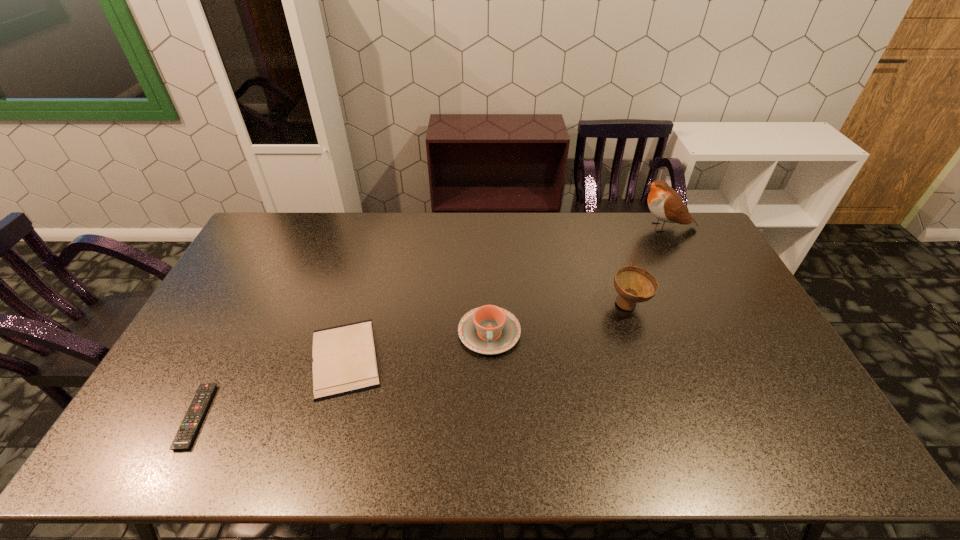
The height and width of the screenshot is (540, 960). Identify the location of the rightmost object. (664, 202).

Locate an element on the screen. The image size is (960, 540). the farthest object is located at coordinates (664, 202).

Locate an element on the screen. This screenshot has width=960, height=540. the fourth object from left to right is located at coordinates (634, 285).

Where is `the fourth shortest object`? the fourth shortest object is located at coordinates (634, 285).

Locate an element on the screen. This screenshot has width=960, height=540. the third tallest object is located at coordinates (489, 329).

Identify the location of chinaware. This screenshot has height=540, width=960. (489, 329).

Image resolution: width=960 pixels, height=540 pixels. Identify the location of the second shortest object. (344, 357).

Identify the location of the fourth object from right to left. The height and width of the screenshot is (540, 960). (344, 357).

Locate an element on the screen. The image size is (960, 540). the leftmost object is located at coordinates (185, 435).

Find the location of a particular element. This screenshot has width=960, height=540. the shortest object is located at coordinates (x=185, y=435).